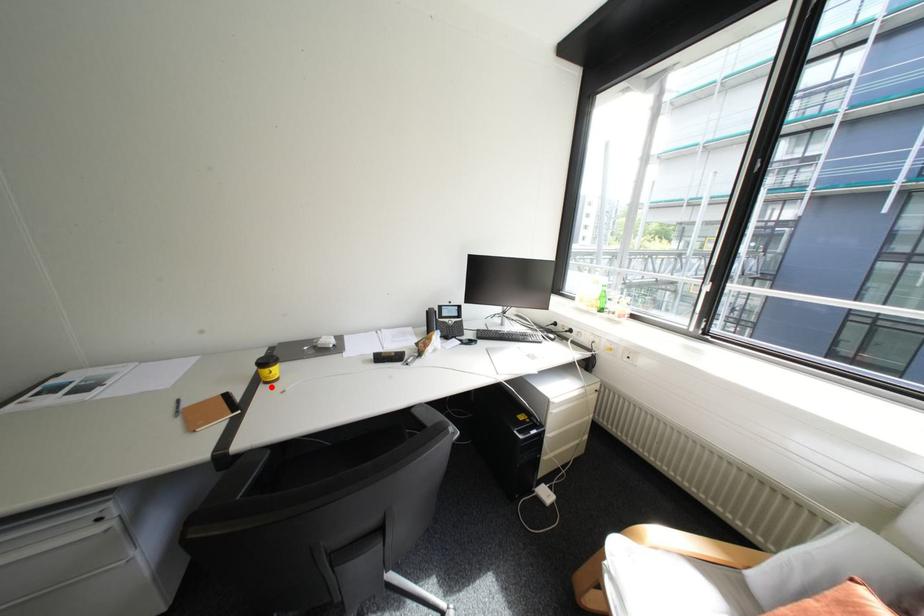
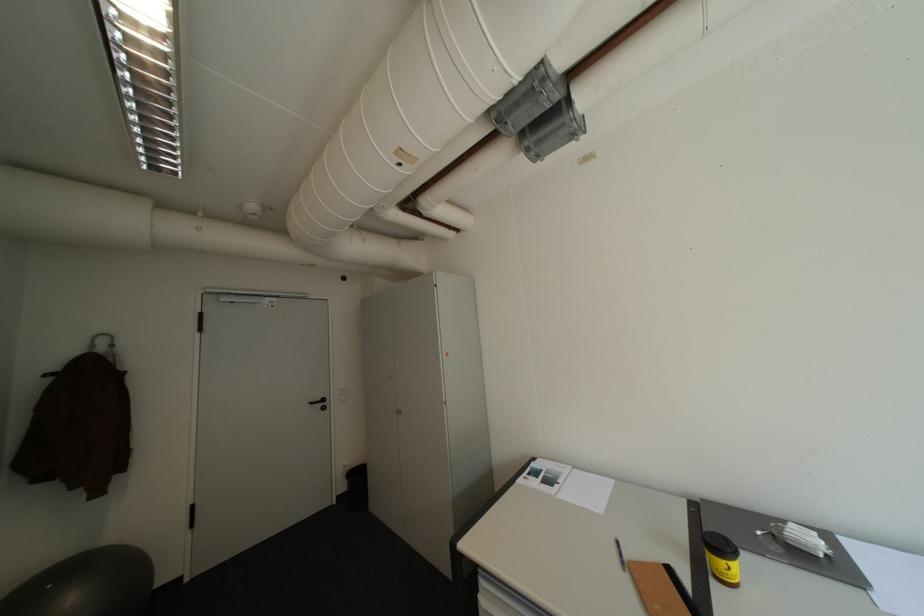
Question: I am providing you with two images of the same scene from different viewpoints. A red point is marked on the first image. Can you still see the location of the red point in image 2?

Choices:
 (A) Yes
 (B) No

Answer: (A)